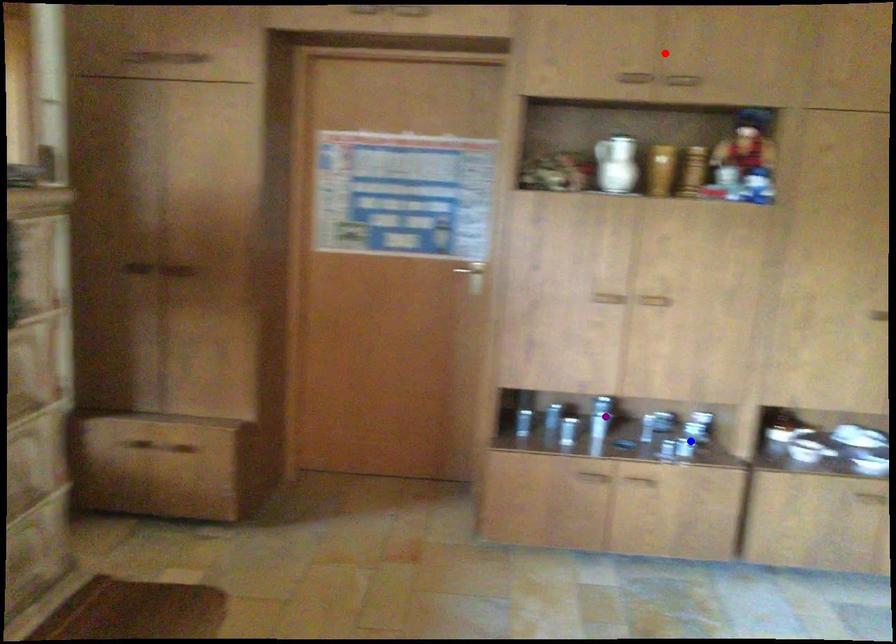
Order these from nearest to farthest:
purple point
red point
blue point

red point, blue point, purple point